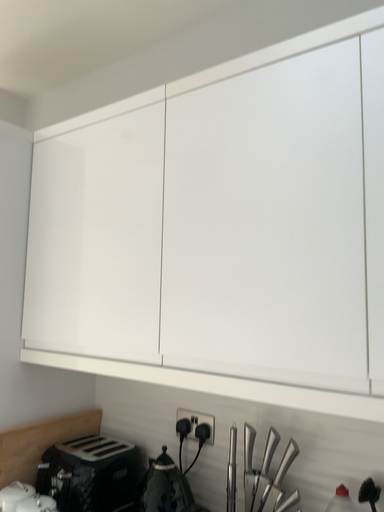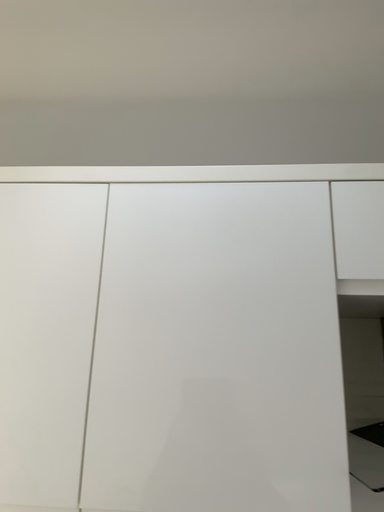
Question: Which way did the camera rotate in the video?

Choices:
 (A) rotated right
 (B) rotated left

Answer: (A)